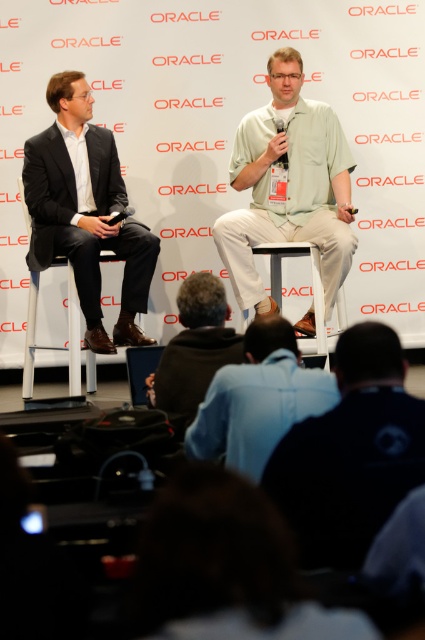
Question: Is light blue shirt at lower center below white plastic chair at left?

Choices:
 (A) yes
 (B) no

Answer: (A)

Question: Considering the relative positions of dark blue fabric shirt at lower center and white plastic chair at left in the image provided, where is dark blue fabric shirt at lower center located with respect to white plastic chair at left?

Choices:
 (A) right
 (B) left

Answer: (A)

Question: Does dark blue fabric shirt at lower center appear over matte black suit at left?

Choices:
 (A) no
 (B) yes

Answer: (A)

Question: Which object is the farthest from the dark brown leather jacket at lower center?

Choices:
 (A) dark blue fabric shirt at lower center
 (B) white plastic chair at center
 (C) light green fabric shirt at center

Answer: (C)

Question: Which of the following is the closest to the observer?

Choices:
 (A) (73, 296)
 (B) (404, 416)
 (C) (306, 392)
 (D) (277, 74)

Answer: (B)

Question: Considering the real-world distances, which object is farthest from the dark brown leather jacket at lower center?

Choices:
 (A) white plastic chair at left
 (B) dark brown hair at lower center

Answer: (A)